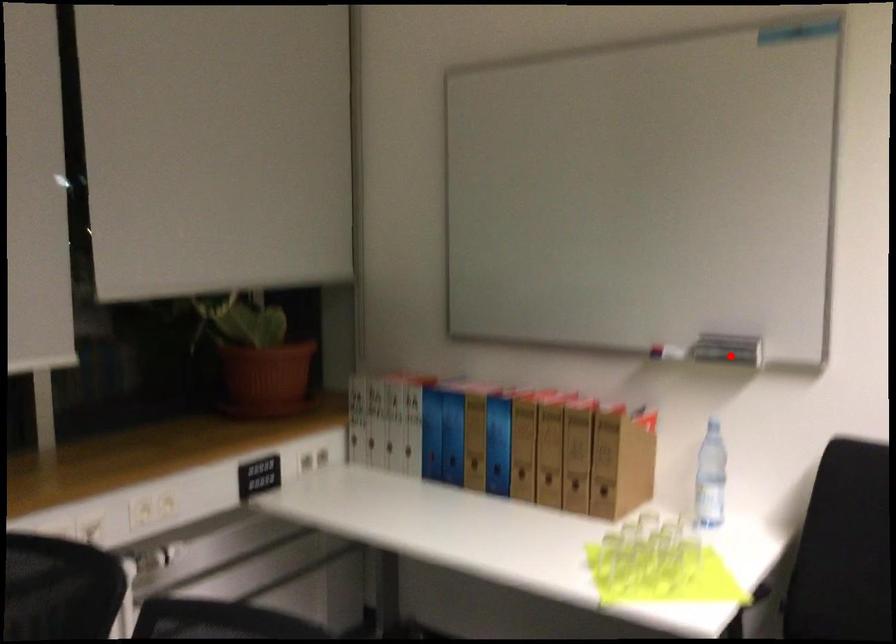
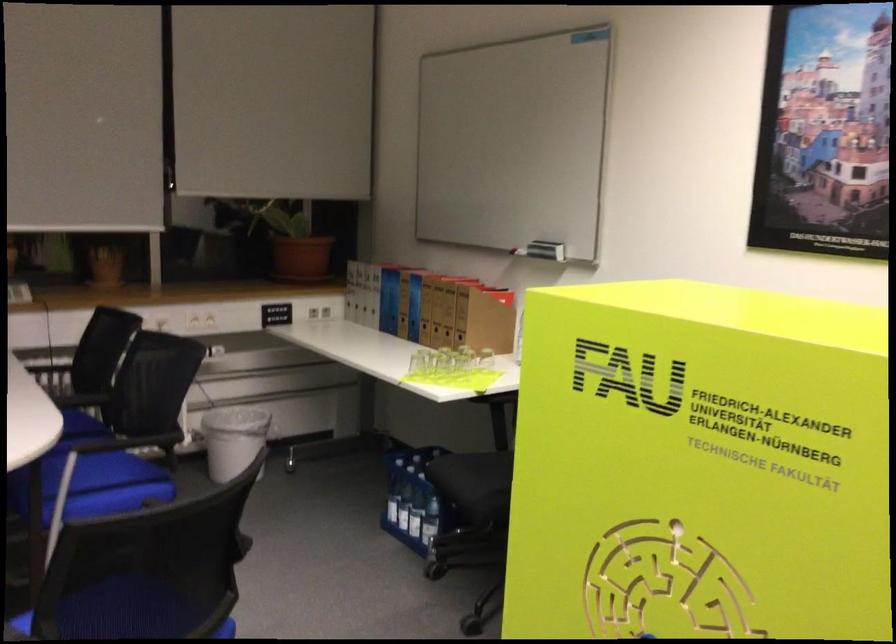
Question: A red point is marked in image1. In image2, is the corresponding 3D point closer to the camera or farther? Reply with the corresponding letter.

Choices:
 (A) The corresponding 3D point is closer.
 (B) The corresponding 3D point is farther.

Answer: (B)